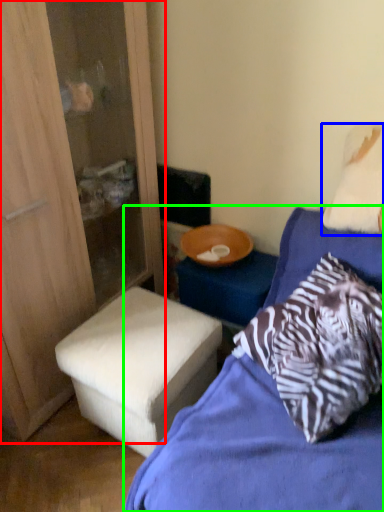
Question: Estimate the real-world distances between objects in this image. Which object is farther from dresser (highlighted by a red box), pillow (highlighted by a blue box) or bed (highlighted by a green box)?

Choices:
 (A) pillow
 (B) bed

Answer: (A)